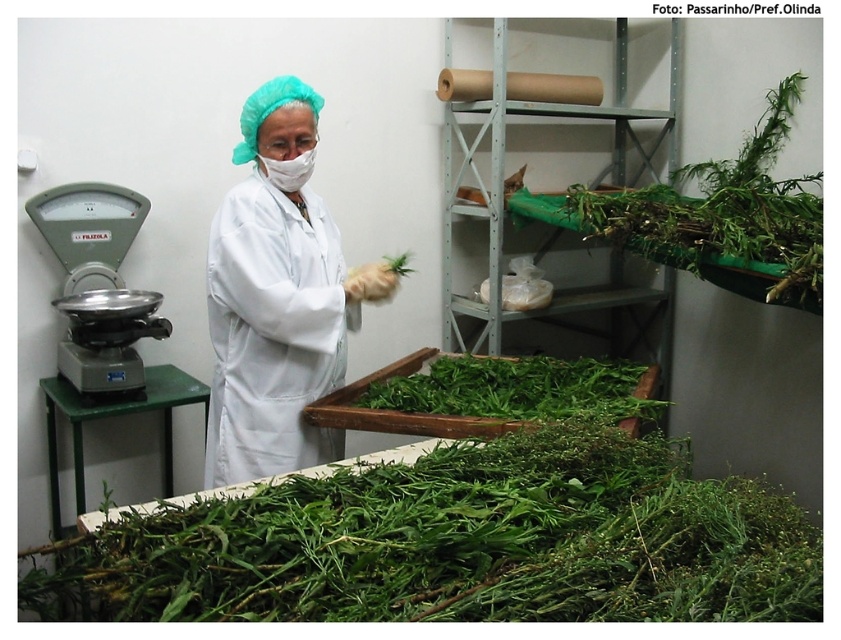
You are a researcher in a lab and need to select a leafy plant sample for analysis. Which of the two options, the green leafy plant at upper right or the green leafy at center, would you choose if you require a larger sample size?

The green leafy plant at upper right is larger in size than the green leafy at center, so you should choose the green leafy plant at upper right for a larger sample size.

In the laboratory scene, there is a person handling green plant material, a tray in the foreground, another tray behind it, and a scale with a metallic bowl to the left. Where is the green leafy plant at upper right located in relation to the other objects?

The green leafy plant at upper right is located at point coordinates of 0.333 on the x axis and 0.862 on the y axis.

You are a researcher in the lab and need to determine which object is larger between the white matte lab coat at center and the green leafy at center. Which one is bigger?

The white matte lab coat at center is bigger than the green leafy at center.